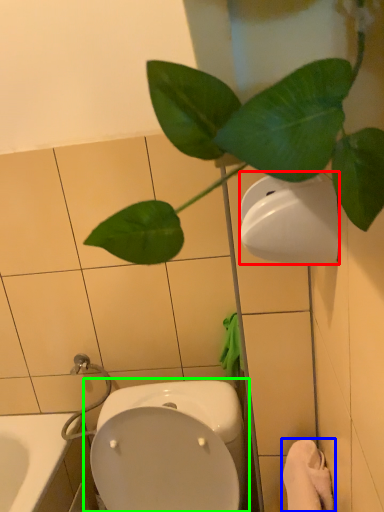
Question: Which object is positioned farthest from toilet paper (highlighted by a red box)? Select from bath towel (highlighted by a blue box) and toilet (highlighted by a green box).

Choices:
 (A) bath towel
 (B) toilet

Answer: (B)